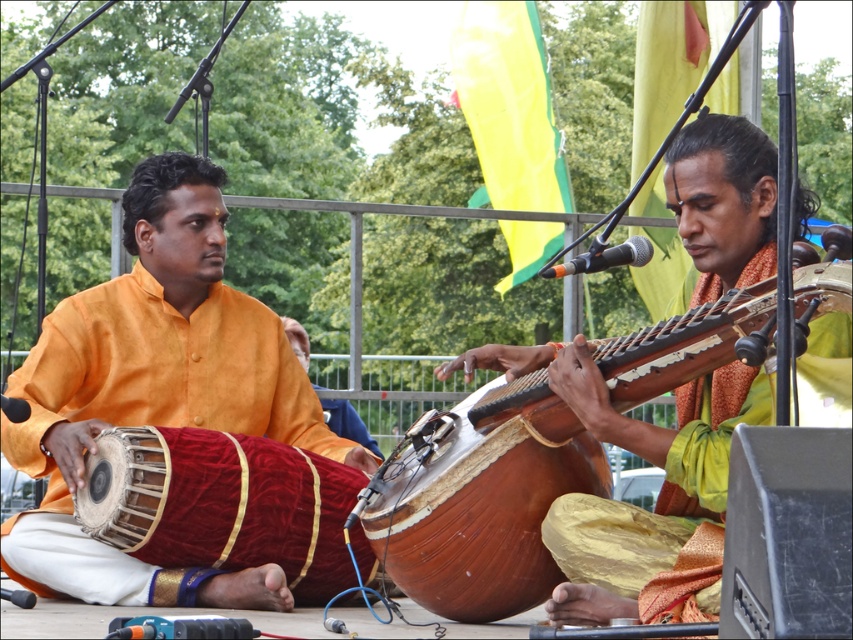
Question: Does matte orange shirt at left appear under wooden acoustic guitar at center?

Choices:
 (A) yes
 (B) no

Answer: (B)

Question: Can you confirm if wooden acoustic guitar at center is smaller than velvet-covered drum at lower left?

Choices:
 (A) no
 (B) yes

Answer: (A)

Question: Which of these objects is positioned closest to the wooden drum at center?

Choices:
 (A) velvet-covered drum at lower left
 (B) wooden acoustic guitar at center
 (C) orange silk shirt at center

Answer: (B)

Question: Among these objects, which one is farthest from the camera?

Choices:
 (A) wooden drum at center
 (B) orange silk shirt at center

Answer: (B)

Question: Does matte orange shirt at left come in front of velvet-covered drum at lower left?

Choices:
 (A) yes
 (B) no

Answer: (A)

Question: Based on their relative distances, which object is farther from the velvet-covered drum at lower left?

Choices:
 (A) wooden drum at center
 (B) matte orange shirt at left
 (C) orange silk shirt at center
 (D) wooden acoustic guitar at center

Answer: (C)